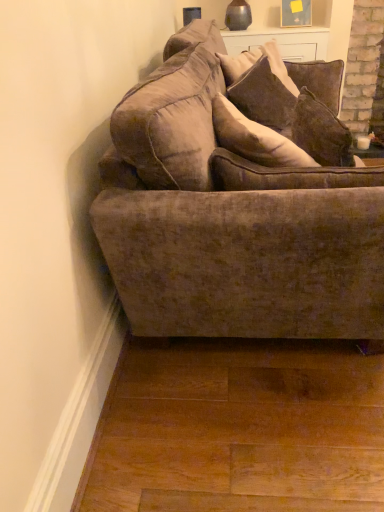
Describe the element at coordinates (240, 201) in the screenshot. I see `velvet brown couch at center` at that location.

What are the coordinates of `velvet brown couch at center` in the screenshot? It's located at (240, 201).

What do you see at coordinates (290, 73) in the screenshot? I see `velvet brown pillow at upper center, the second pillow when ordered from front to back` at bounding box center [290, 73].

You are a GUI agent. You are given a task and a screenshot of the screen. Output one action in this format:
    pyautogui.click(x=<x>, y=<y>)
    Task: Click on the velvet brown pillow at upper center, which is the first pillow in front-to-back order
    This screenshot has width=384, height=512.
    Given the screenshot: What is the action you would take?
    pyautogui.click(x=263, y=96)

You are a GUI agent. You are given a task and a screenshot of the screen. Output one action in this format:
    pyautogui.click(x=<x>, y=<y>)
    Task: Click on the pillow directly beneath the velvet brown pillow at upper center, the second pillow when ordered from back to front (from a real-world perspective)
    Image resolution: width=384 pixels, height=512 pixels.
    Given the screenshot: What is the action you would take?
    pyautogui.click(x=290, y=73)

Is velvet brown pillow at upper center, the second pillow when ordered from back to front, not close to velvet brown pillow at upper center, placed as the 1th pillow when sorted from back to front?

Actually, velvet brown pillow at upper center, the second pillow when ordered from back to front, and velvet brown pillow at upper center, placed as the 1th pillow when sorted from back to front, are a little close together.

Looking at this image, does velvet brown pillow at upper center, the second pillow when ordered from back to front, turn towards velvet brown pillow at upper center, the second pillow when ordered from front to back?

No, velvet brown pillow at upper center, the second pillow when ordered from back to front, is not aimed at velvet brown pillow at upper center, the second pillow when ordered from front to back.

From the image's perspective, is velvet brown pillow at upper center, which is the first pillow in front-to-back order, located above or below velvet brown pillow at upper center, placed as the 1th pillow when sorted from back to front?

Based on their image positions, velvet brown pillow at upper center, which is the first pillow in front-to-back order, is located beneath velvet brown pillow at upper center, placed as the 1th pillow when sorted from back to front.

Does point (265, 76) come farther from viewer compared to point (327, 280)?

Yes, it is.

Relative to velvet brown couch at center, is velvet brown pillow at upper center, the second pillow when ordered from back to front, in front or behind?

Clearly, velvet brown pillow at upper center, the second pillow when ordered from back to front, is behind velvet brown couch at center.

Looking at this image, from a real-world perspective, which object stands above the other?

velvet brown pillow at upper center, which is the first pillow in front-to-back order.

Based on their positions, is velvet brown couch at center located to the left or right of velvet brown pillow at upper center, placed as the 1th pillow when sorted from back to front?

From the image, it's evident that velvet brown couch at center is to the left of velvet brown pillow at upper center, placed as the 1th pillow when sorted from back to front.

Which point is more distant from viewer, [265,206] or [288,68]?

The point [288,68] is more distant.

Is there a large distance between velvet brown couch at center and velvet brown pillow at upper center, the second pillow when ordered from back to front?

No, velvet brown couch at center is not far away from velvet brown pillow at upper center, the second pillow when ordered from back to front.

Is velvet brown couch at center positioned with its back to velvet brown pillow at upper center, the second pillow when ordered from back to front?

Absolutely, velvet brown couch at center is directed away from velvet brown pillow at upper center, the second pillow when ordered from back to front.

Is velvet brown couch at center closer to the viewer compared to velvet brown pillow at upper center, which is the first pillow in front-to-back order?

Yes, it is.

Based on their sizes in the image, would you say velvet brown couch at center is bigger or smaller than velvet brown pillow at upper center, the second pillow when ordered from back to front?

Considering their sizes, velvet brown couch at center takes up more space than velvet brown pillow at upper center, the second pillow when ordered from back to front.

From a real-world perspective, who is located higher, velvet brown pillow at upper center, placed as the 1th pillow when sorted from back to front, or velvet brown couch at center?

velvet brown pillow at upper center, placed as the 1th pillow when sorted from back to front.

Is velvet brown pillow at upper center, the second pillow when ordered from front to back, positioned far away from velvet brown couch at center?

No, there isn't a large distance between velvet brown pillow at upper center, the second pillow when ordered from front to back, and velvet brown couch at center.

Considering the relative sizes of velvet brown pillow at upper center, placed as the 1th pillow when sorted from back to front, and velvet brown couch at center in the image provided, is velvet brown pillow at upper center, placed as the 1th pillow when sorted from back to front, wider than velvet brown couch at center?

No.

What are the coordinates of `studio couch in front of the velvet brown pillow at upper center, the second pillow when ordered from front to back` in the screenshot? It's located at (240, 201).

In the scene shown: Is velvet brown pillow at upper center, the second pillow when ordered from front to back, facing towards velvet brown pillow at upper center, which is the first pillow in front-to-back order?

Yes, velvet brown pillow at upper center, the second pillow when ordered from front to back, is turned towards velvet brown pillow at upper center, which is the first pillow in front-to-back order.

Does point (236, 79) appear closer or farther from the camera than point (257, 118)?

Point (236, 79) is positioned farther from the camera compared to point (257, 118).

Is velvet brown pillow at upper center, placed as the 1th pillow when sorted from back to front, wider or thinner than velvet brown pillow at upper center, the second pillow when ordered from back to front?

velvet brown pillow at upper center, placed as the 1th pillow when sorted from back to front, is thinner than velvet brown pillow at upper center, the second pillow when ordered from back to front.

There is a velvet brown pillow at upper center, the second pillow when ordered from front to back. At what (x,y) coordinates should I click in order to perform the action: click on pillow above it (from a real-world perspective). Please return your answer as a coordinate pair (x, y). The width and height of the screenshot is (384, 512). Looking at the image, I should click on click(263, 96).

This screenshot has height=512, width=384. In order to click on studio couch in front of the velvet brown pillow at upper center, which is the first pillow in front-to-back order in this screenshot , I will do `click(240, 201)`.

Which object lies nearer to the anchor point velvet brown couch at center, velvet brown pillow at upper center, placed as the 1th pillow when sorted from back to front, or velvet brown pillow at upper center, the second pillow when ordered from back to front?

Based on the image, velvet brown pillow at upper center, the second pillow when ordered from back to front, appears to be nearer to velvet brown couch at center.

Based on their spatial positions, is velvet brown pillow at upper center, which is the first pillow in front-to-back order, or velvet brown couch at center closer to velvet brown pillow at upper center, placed as the 1th pillow when sorted from back to front?

The object closer to velvet brown pillow at upper center, placed as the 1th pillow when sorted from back to front, is velvet brown pillow at upper center, which is the first pillow in front-to-back order.

Looking at the image, which one is located closer to velvet brown pillow at upper center, placed as the 1th pillow when sorted from back to front, velvet brown couch at center or velvet brown pillow at upper center, which is the first pillow in front-to-back order?

velvet brown pillow at upper center, which is the first pillow in front-to-back order, lies closer to velvet brown pillow at upper center, placed as the 1th pillow when sorted from back to front, than the other object.

Estimate the real-world distances between objects in this image. Which object is further from velvet brown couch at center, velvet brown pillow at upper center, which is the first pillow in front-to-back order, or velvet brown pillow at upper center, placed as the 1th pillow when sorted from back to front?

Among the two, velvet brown pillow at upper center, placed as the 1th pillow when sorted from back to front, is located further to velvet brown couch at center.

When comparing their distances from velvet brown pillow at upper center, which is the first pillow in front-to-back order, does velvet brown couch at center or velvet brown pillow at upper center, placed as the 1th pillow when sorted from back to front, seem further?

Based on the image, velvet brown couch at center appears to be further to velvet brown pillow at upper center, which is the first pillow in front-to-back order.

From the image, which object appears to be farther from velvet brown pillow at upper center, which is the first pillow in front-to-back order, velvet brown pillow at upper center, the second pillow when ordered from front to back, or velvet brown couch at center?

Based on the image, velvet brown couch at center appears to be further to velvet brown pillow at upper center, which is the first pillow in front-to-back order.

Where is `pillow between velvet brown couch at center and velvet brown pillow at upper center, placed as the 1th pillow when sorted from back to front, along the z-axis`? Image resolution: width=384 pixels, height=512 pixels. pillow between velvet brown couch at center and velvet brown pillow at upper center, placed as the 1th pillow when sorted from back to front, along the z-axis is located at coordinates (263, 96).